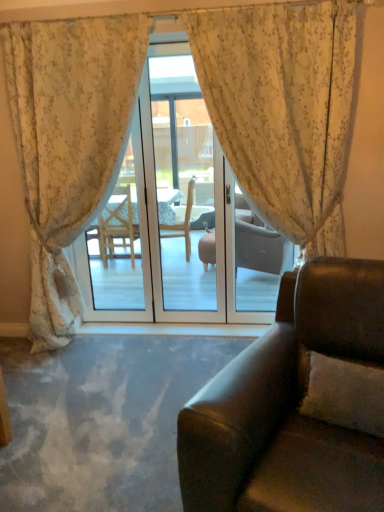
What do you see at coordinates (296, 403) in the screenshot? This screenshot has height=512, width=384. I see `leather couch at lower right` at bounding box center [296, 403].

In order to face transparent glass door at center, should I rotate leftwards or rightwards?

A 6.352 degree turn to the left will do.

Describe the element at coordinates (68, 142) in the screenshot. The image size is (384, 512). I see `floral fabric curtain at center, placed as the first curtain when sorted from left to right` at that location.

Find the location of a particular element. The height and width of the screenshot is (512, 384). floral sheer curtain at center, which is the 1th curtain in right-to-left order is located at coordinates (283, 109).

Describe the element at coordinates (283, 109) in the screenshot. I see `floral sheer curtain at center, which is the 1th curtain in right-to-left order` at that location.

Consider the image. What is the approximate height of white textured pillow at lower right?

13.77 inches.

Where is `leather couch at lower right`? leather couch at lower right is located at coordinates (296, 403).

Could transparent glass door at center be considered to be inside floral sheer curtain at center, which is the 1th curtain in right-to-left order?

No.

How much distance is there between floral sheer curtain at center, which is the 1th curtain in right-to-left order, and transparent glass door at center?

floral sheer curtain at center, which is the 1th curtain in right-to-left order, and transparent glass door at center are 2.58 meters apart.

From the picture: Considering the positions of objects floral sheer curtain at center, the second curtain from the left, and transparent glass door at center in the image provided, who is more to the right, floral sheer curtain at center, the second curtain from the left, or transparent glass door at center?

floral sheer curtain at center, the second curtain from the left, is more to the right.

This screenshot has width=384, height=512. Find the location of `door located behind the floral sheer curtain at center, the second curtain from the left`. door located behind the floral sheer curtain at center, the second curtain from the left is located at coordinates (180, 219).

Which is more to the right, floral sheer curtain at center, which is the 1th curtain in right-to-left order, or floral fabric curtain at center, placed as the first curtain when sorted from left to right?

Positioned to the right is floral sheer curtain at center, which is the 1th curtain in right-to-left order.

Is floral sheer curtain at center, the second curtain from the left, positioned in front of floral fabric curtain at center, which is the second curtain in right-to-left order?

That is True.

Is floral sheer curtain at center, which is the 1th curtain in right-to-left order, turned away from floral fabric curtain at center, placed as the first curtain when sorted from left to right?

floral sheer curtain at center, which is the 1th curtain in right-to-left order, does not have its back to floral fabric curtain at center, placed as the first curtain when sorted from left to right.

Is floral sheer curtain at center, which is the 1th curtain in right-to-left order, shorter than floral fabric curtain at center, which is the second curtain in right-to-left order?

In fact, floral sheer curtain at center, which is the 1th curtain in right-to-left order, may be taller than floral fabric curtain at center, which is the second curtain in right-to-left order.

Is floral sheer curtain at center, which is the 1th curtain in right-to-left order, wider or thinner than white textured pillow at lower right?

Clearly, floral sheer curtain at center, which is the 1th curtain in right-to-left order, has more width compared to white textured pillow at lower right.

From a real-world perspective, between floral sheer curtain at center, the second curtain from the left, and white textured pillow at lower right, who is vertically lower?

white textured pillow at lower right is physically lower.

Is white textured pillow at lower right surrounded by floral sheer curtain at center, the second curtain from the left?

No, white textured pillow at lower right is not inside floral sheer curtain at center, the second curtain from the left.

From the image's perspective, which is below, floral sheer curtain at center, which is the 1th curtain in right-to-left order, or white textured pillow at lower right?

white textured pillow at lower right.

From the image's perspective, is leather couch at lower right positioned above or below floral fabric curtain at center, which is the second curtain in right-to-left order?

Based on their image positions, leather couch at lower right is located beneath floral fabric curtain at center, which is the second curtain in right-to-left order.

Is leather couch at lower right not close to floral fabric curtain at center, placed as the first curtain when sorted from left to right?

Yes.

Which of these two, leather couch at lower right or floral fabric curtain at center, which is the second curtain in right-to-left order, stands shorter?

leather couch at lower right is shorter.

Does floral fabric curtain at center, which is the second curtain in right-to-left order, appear on the left side of white textured pillow at lower right?

Yes.

Based on their sizes in the image, would you say floral fabric curtain at center, which is the second curtain in right-to-left order, is bigger or smaller than white textured pillow at lower right?

Clearly, floral fabric curtain at center, which is the second curtain in right-to-left order, is larger in size than white textured pillow at lower right.

Would you say leather couch at lower right is outside transparent glass door at center?

leather couch at lower right is positioned outside transparent glass door at center.

Considering the positions of objects leather couch at lower right and transparent glass door at center in the image provided, who is behind, leather couch at lower right or transparent glass door at center?

Positioned behind is transparent glass door at center.

Which object is thinner, leather couch at lower right or transparent glass door at center?

transparent glass door at center.

Which is more to the right, leather couch at lower right or transparent glass door at center?

leather couch at lower right is more to the right.

Does point (340, 384) come in front of point (195, 412)?

No, it is behind (195, 412).

Between white textured pillow at lower right and leather couch at lower right, which one appears on the right side from the viewer's perspective?

Positioned to the right is white textured pillow at lower right.

Is white textured pillow at lower right turned away from leather couch at lower right?

Yes, white textured pillow at lower right is positioned with its back facing leather couch at lower right.

Identify the location of the 2nd curtain in front of the transparent glass door at center, counting from the anchor's position. (283, 109).

Find the location of a particular element. Image resolution: width=384 pixels, height=512 pixels. curtain that appears below the floral sheer curtain at center, which is the 1th curtain in right-to-left order (from the image's perspective) is located at coordinates (68, 142).

Based on their spatial positions, is floral fabric curtain at center, placed as the first curtain when sorted from left to right, or leather couch at lower right closer to transparent glass door at center?

floral fabric curtain at center, placed as the first curtain when sorted from left to right.

Based on their spatial positions, is transparent glass door at center or floral fabric curtain at center, placed as the first curtain when sorted from left to right, further from leather couch at lower right?

Based on the image, transparent glass door at center appears to be further to leather couch at lower right.

Looking at the image, which one is located closer to floral fabric curtain at center, which is the second curtain in right-to-left order, transparent glass door at center or floral sheer curtain at center, which is the 1th curtain in right-to-left order?

floral sheer curtain at center, which is the 1th curtain in right-to-left order, lies closer to floral fabric curtain at center, which is the second curtain in right-to-left order, than the other object.

Based on the photo, from the image, which object appears to be farther from leather couch at lower right, floral fabric curtain at center, which is the second curtain in right-to-left order, or transparent glass door at center?

Among the two, transparent glass door at center is located further to leather couch at lower right.

Looking at the image, which one is located closer to transparent glass door at center, leather couch at lower right or floral fabric curtain at center, which is the second curtain in right-to-left order?

floral fabric curtain at center, which is the second curtain in right-to-left order, is closer to transparent glass door at center.

Estimate the real-world distances between objects in this image. Which object is closer to floral fabric curtain at center, placed as the first curtain when sorted from left to right, floral sheer curtain at center, which is the 1th curtain in right-to-left order, or leather couch at lower right?

The object closer to floral fabric curtain at center, placed as the first curtain when sorted from left to right, is floral sheer curtain at center, which is the 1th curtain in right-to-left order.

When comparing their distances from white textured pillow at lower right, does floral sheer curtain at center, the second curtain from the left, or floral fabric curtain at center, which is the second curtain in right-to-left order, seem closer?

floral sheer curtain at center, the second curtain from the left.

From the image, which object appears to be nearer to floral fabric curtain at center, which is the second curtain in right-to-left order, transparent glass door at center or white textured pillow at lower right?

Based on the image, white textured pillow at lower right appears to be nearer to floral fabric curtain at center, which is the second curtain in right-to-left order.

At what (x,y) coordinates should I click in order to perform the action: click on pillow located between floral fabric curtain at center, placed as the first curtain when sorted from left to right, and floral sheer curtain at center, which is the 1th curtain in right-to-left order, in the left-right direction. Please return your answer as a coordinate pair (x, y). Looking at the image, I should click on (345, 394).

At what (x,y) coordinates should I click in order to perform the action: click on pillow between leather couch at lower right and transparent glass door at center in the front-back direction. Please return your answer as a coordinate pair (x, y). The image size is (384, 512). Looking at the image, I should click on (345, 394).

Find the location of a particular element. The height and width of the screenshot is (512, 384). pillow between leather couch at lower right and floral fabric curtain at center, which is the second curtain in right-to-left order, in the front-back direction is located at coordinates (345, 394).

Locate an element on the screen. The width and height of the screenshot is (384, 512). curtain between leather couch at lower right and floral fabric curtain at center, which is the second curtain in right-to-left order, along the z-axis is located at coordinates (283, 109).